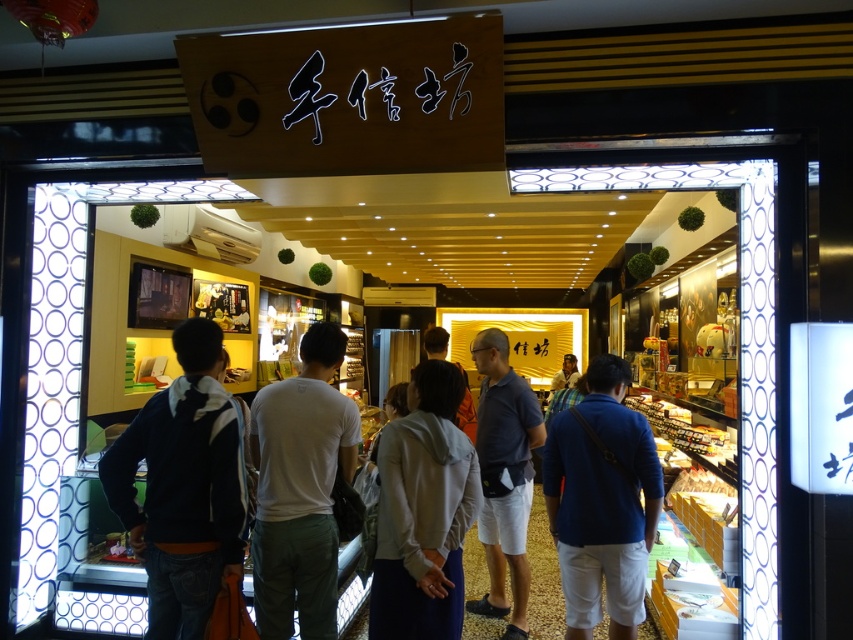
Is white cotton t-shirt at center shorter than blue cotton shirt at center?

No, white cotton t-shirt at center is not shorter than blue cotton shirt at center.

From the picture: Is white cotton t-shirt at center taller than blue cotton shirt at center?

Yes.

Is point (312, 637) positioned before point (616, 492)?

Yes, point (312, 637) is in front of point (616, 492).

Identify the location of white cotton t-shirt at center. The height and width of the screenshot is (640, 853). (300, 490).

Looking at this image, between dark blue hoodie at left and light brown leather jacket at center, which one has more height?

Standing taller between the two is dark blue hoodie at left.

From the picture: Which is more to the left, dark blue hoodie at left or light brown leather jacket at center?

From the viewer's perspective, dark blue hoodie at left appears more on the left side.

Who is more forward, (204, 428) or (436, 348)?

Point (204, 428) is in front.

Where is `dark blue hoodie at left`? This screenshot has width=853, height=640. dark blue hoodie at left is located at coordinates (183, 486).

Is point (544, 456) closer to viewer compared to point (416, 458)?

No, (544, 456) is further to viewer.

Which is behind, point (614, 604) or point (469, 490)?

Point (614, 604)

Find the location of a particular element. blue cotton shirt at center is located at coordinates (602, 502).